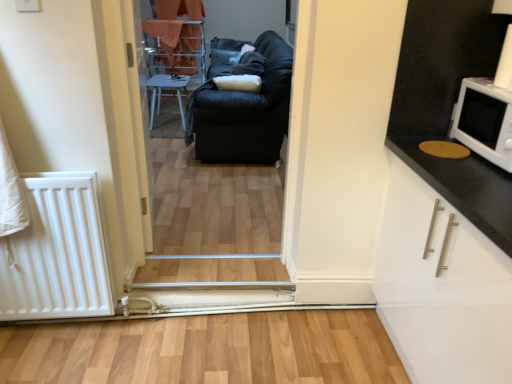
Question: Does point (238, 134) appear closer or farther from the camera than point (156, 104)?

Choices:
 (A) farther
 (B) closer

Answer: (B)

Question: From the image's perspective, is black leather couch at center above or below white plastic chair at center?

Choices:
 (A) above
 (B) below

Answer: (A)

Question: Based on their relative distances, which object is farther from the white plastic chair at center?

Choices:
 (A) black leather couch at center
 (B) orange fabric bunk bed at upper left
 (C) white wood door at center
 (D) black leather couch at center
 (E) white glossy microwave at upper right

Answer: (E)

Question: Estimate the real-world distances between objects in this image. Which object is farther from the white wood door at center?

Choices:
 (A) black leather couch at center
 (B) white glossy microwave at upper right
 (C) black leather couch at center
 (D) orange fabric bunk bed at upper left
 (E) white plastic chair at center

Answer: (B)